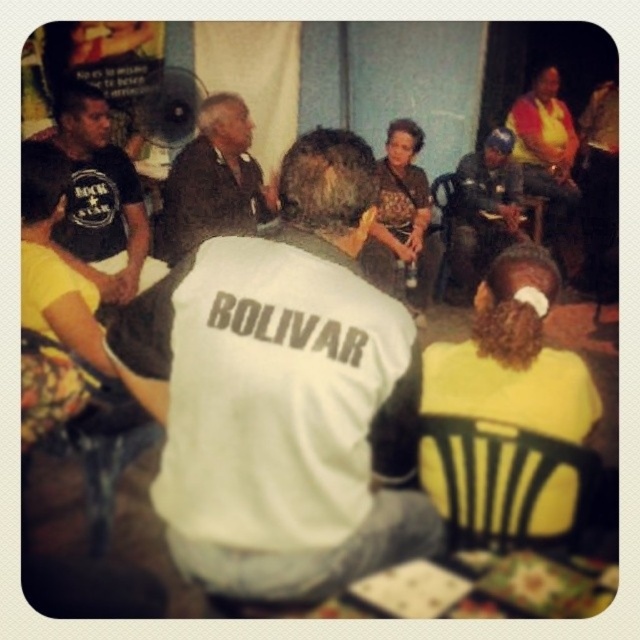
Measure the distance between dark brown leather jacket at center and blue helmet at center.

They are 5.49 feet apart.

Describe the element at coordinates (212, 180) in the screenshot. I see `dark brown leather jacket at center` at that location.

You are a GUI agent. You are given a task and a screenshot of the screen. Output one action in this format:
    pyautogui.click(x=<x>, y=<y>)
    Task: Click on the dark brown leather jacket at center
    Image resolution: width=640 pixels, height=640 pixels.
    Given the screenshot: What is the action you would take?
    pyautogui.click(x=212, y=180)

The image size is (640, 640). I want to click on dark brown leather jacket at center, so click(x=212, y=180).

Does black plastic chair at lower right have a greater height compared to black t-shirt at left?

In fact, black plastic chair at lower right may be shorter than black t-shirt at left.

Is point (502, 499) positioned in front of point (129, 291)?

Yes, point (502, 499) is in front of point (129, 291).

Which is in front, point (572, 477) or point (125, 234)?

Point (572, 477) is more forward.

Image resolution: width=640 pixels, height=640 pixels. Identify the location of black plastic chair at lower right. (506, 483).

You are a GUI agent. You are given a task and a screenshot of the screen. Output one action in this format:
    pyautogui.click(x=<x>, y=<y>)
    Task: Click on the black plastic chair at lower right
    This screenshot has height=640, width=640.
    Given the screenshot: What is the action you would take?
    pyautogui.click(x=506, y=483)

Is black plastic chair at lower right positioned behind blue helmet at center?

That is False.

Locate an element on the screen. black plastic chair at lower right is located at coordinates (506, 483).

You are a GUI agent. You are given a task and a screenshot of the screen. Output one action in this format:
    pyautogui.click(x=<x>, y=<y>)
    Task: Click on the black plastic chair at lower right
    The height and width of the screenshot is (640, 640).
    Given the screenshot: What is the action you would take?
    pyautogui.click(x=506, y=483)